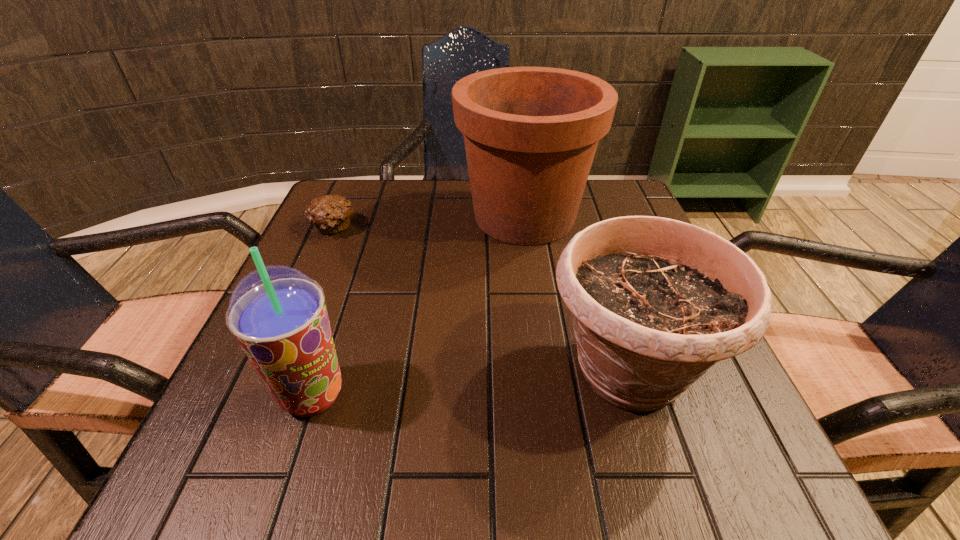
Find the location of a particular element. Image resolution: width=960 pixels, height=540 pixels. free space between the muffin and the taller flowerpot is located at coordinates (428, 222).

Find the location of a particular element. free spot between the smoothie and the farther flowerpot is located at coordinates (419, 306).

The width and height of the screenshot is (960, 540). In order to click on free space between the shorter flowerpot and the shortest object in this screenshot , I will do `click(480, 300)`.

Identify the location of unoccupied position between the farther flowerpot and the muffin. The image size is (960, 540). (428, 222).

This screenshot has height=540, width=960. In order to click on free space between the nearer flowerpot and the smoothie in this screenshot , I will do `click(470, 383)`.

Image resolution: width=960 pixels, height=540 pixels. What are the coordinates of `vacant space in between the muffin and the second shortest object` in the screenshot? It's located at (480, 300).

Where is `unoccupied position between the smoothie and the farther flowerpot`? The height and width of the screenshot is (540, 960). unoccupied position between the smoothie and the farther flowerpot is located at coordinates (419, 306).

Find the location of a particular element. This screenshot has height=540, width=960. blank region between the shorter flowerpot and the shortest object is located at coordinates (480, 300).

Locate which object is the third closest to the shortest object. Please provide its 2D coordinates. Your answer should be formatted as a tuple, i.e. [(x, y)], where the tuple contains the x and y coordinates of a point satisfying the conditions above.

[(655, 302)]

Identify which object is the nearest to the shorter flowerpot. Please provide its 2D coordinates. Your answer should be formatted as a tuple, i.e. [(x, y)], where the tuple contains the x and y coordinates of a point satisfying the conditions above.

[(531, 133)]